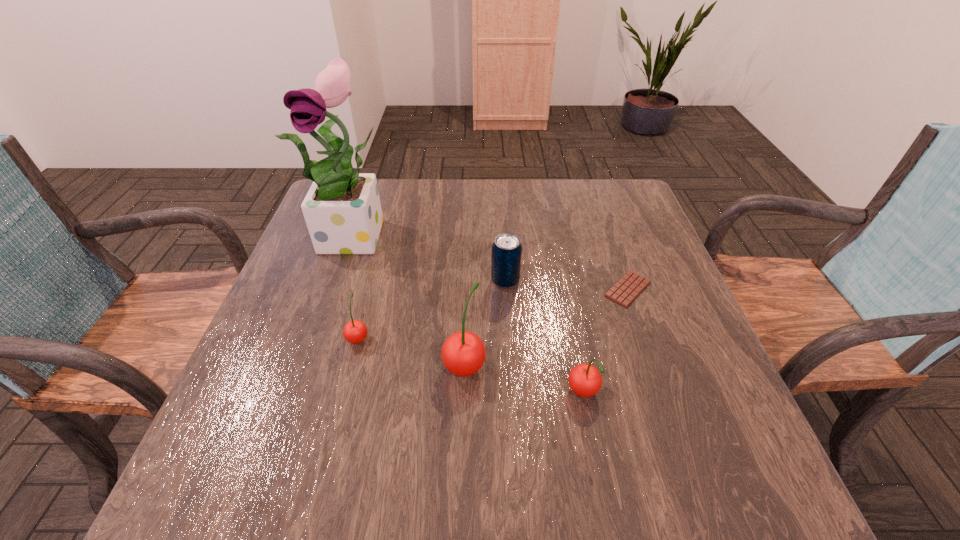
The width and height of the screenshot is (960, 540). Find the location of `cherry object that ranks as the closest to the candy bar`. cherry object that ranks as the closest to the candy bar is located at coordinates (585, 380).

The width and height of the screenshot is (960, 540). Identify the location of vacant space that satisfies the following two spatial constraints: 1. on the front-facing side of the flower arrangement; 2. on the left side of the soda can. (344, 281).

This screenshot has width=960, height=540. What are the coordinates of `vacant area in the image that satisfies the following two spatial constraints: 1. on the back side of the leftmost cherry; 2. on the left side of the soda can` in the screenshot? It's located at (372, 281).

The image size is (960, 540). In order to click on free location that satisfies the following two spatial constraints: 1. on the front-facing side of the farthest object; 2. on the left side of the rightmost object in this screenshot , I will do `click(341, 289)`.

The width and height of the screenshot is (960, 540). What are the coordinates of `free space that satisfies the following two spatial constraints: 1. on the front-facing side of the flower arrangement; 2. on the right side of the rightmost cherry` in the screenshot? It's located at (306, 394).